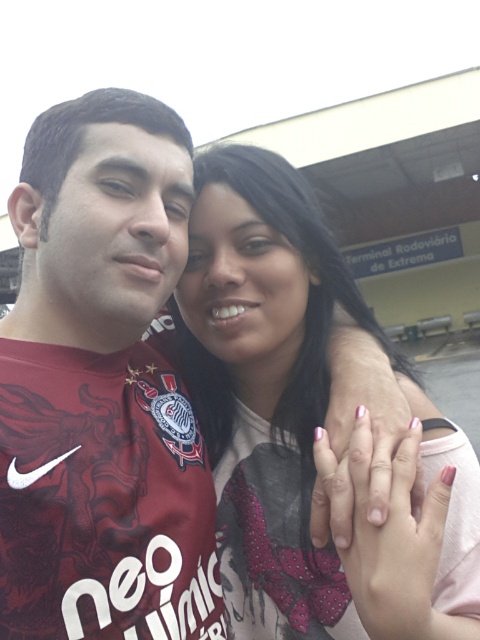
Does maroon jersey at left have a larger size compared to matte pink shirt at center?

No, maroon jersey at left is not bigger than matte pink shirt at center.

Does maroon jersey at left appear under matte pink shirt at center?

Yes, maroon jersey at left is below matte pink shirt at center.

Locate an element on the screen. This screenshot has height=640, width=480. maroon jersey at left is located at coordinates (101, 387).